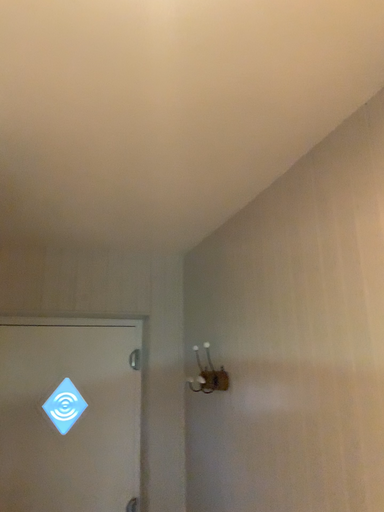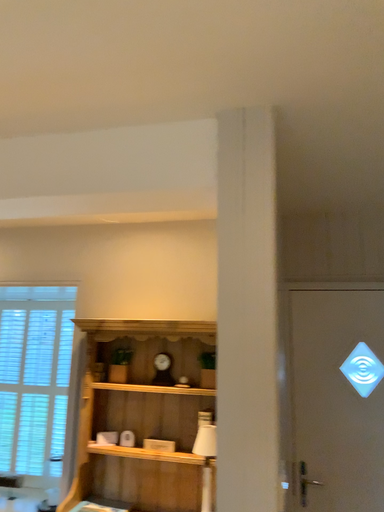
Question: Which way did the camera rotate in the video?

Choices:
 (A) rotated left
 (B) rotated right

Answer: (A)